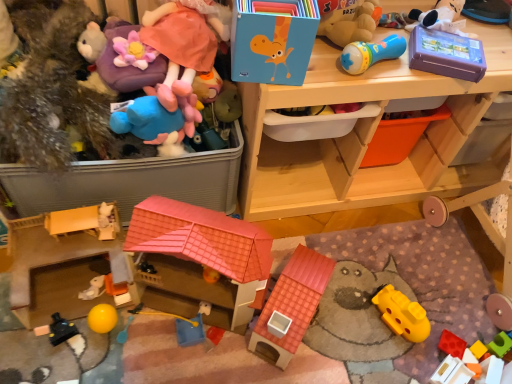
At what (x,y) coordinates should I click in order to perform the action: click on free space between rubberized red block at lower right, which appears as the 2th toy when viewed from the right, and blue plastic toy at center, the 8th toy viewed from the left. Please return your answer as a coordinate pair (x, y). Looking at the image, I should click on 333,344.